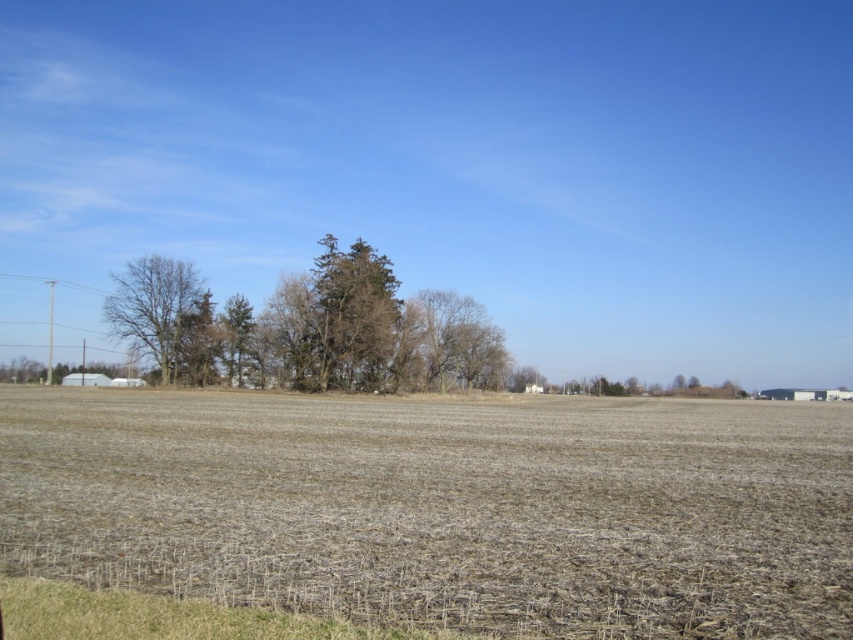
You are a hiker who wants to take a photo of the brown textured tree at center from the edge of the field. Given that the field is uneven and has scattered crop residue, will you need to adjust your footing to maintain balance while taking the photo?

The field has scattered crop residue and stubble, which may cause uneven terrain. You may need to adjust your footing to maintain balance while taking the photo of the brown textured tree at center.

You are a bird seeking shelter in the rural landscape. You spot the brown textured tree at center and the bare branches at left. Which tree would provide a narrower perch for your landing?

The brown textured tree at center is thinner than the bare branches at left, so it would provide a narrower perch for landing.